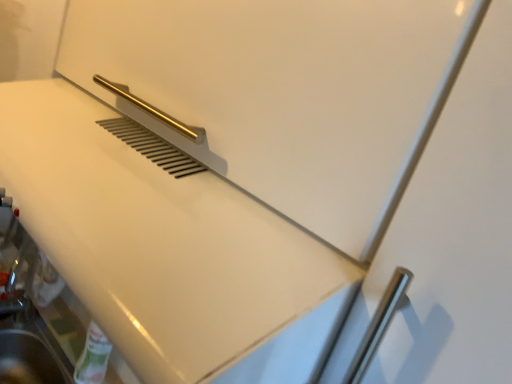
What do you see at coordinates (167, 249) in the screenshot? Image resolution: width=512 pixels, height=384 pixels. I see `white glossy counter top at center` at bounding box center [167, 249].

Identify the location of white glossy counter top at center. This screenshot has height=384, width=512. (167, 249).

Locate an element on the screen. The width and height of the screenshot is (512, 384). white glossy counter top at center is located at coordinates (167, 249).